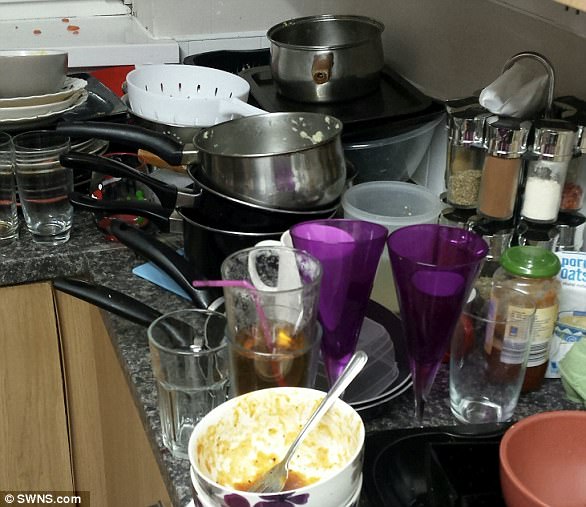
At what (x,y) coordinates should I click in order to perform the action: click on pepper and salt shaker. Please return your answer as a coordinate pair (x, y). This screenshot has height=507, width=586. Looking at the image, I should click on (x=462, y=163), (x=545, y=184).